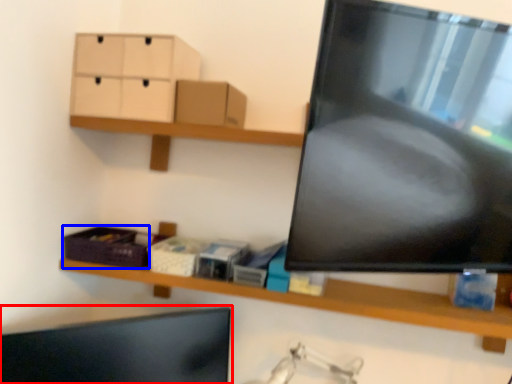
Question: Among these objects, which one is farthest to the camera, computer monitor (highlighted by a red box) or storage box (highlighted by a blue box)?

Choices:
 (A) computer monitor
 (B) storage box

Answer: (B)